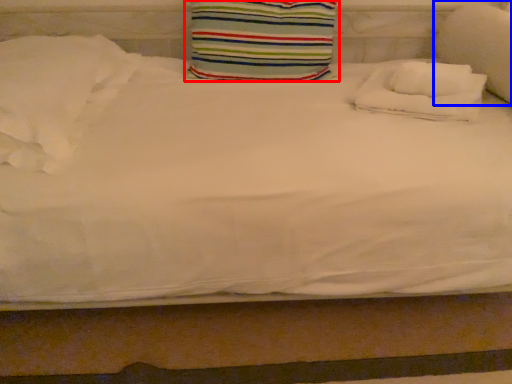
Question: Which object appears farthest to the camera in this image, pillow (highlighted by a red box) or pillow (highlighted by a blue box)?

Choices:
 (A) pillow
 (B) pillow

Answer: (A)